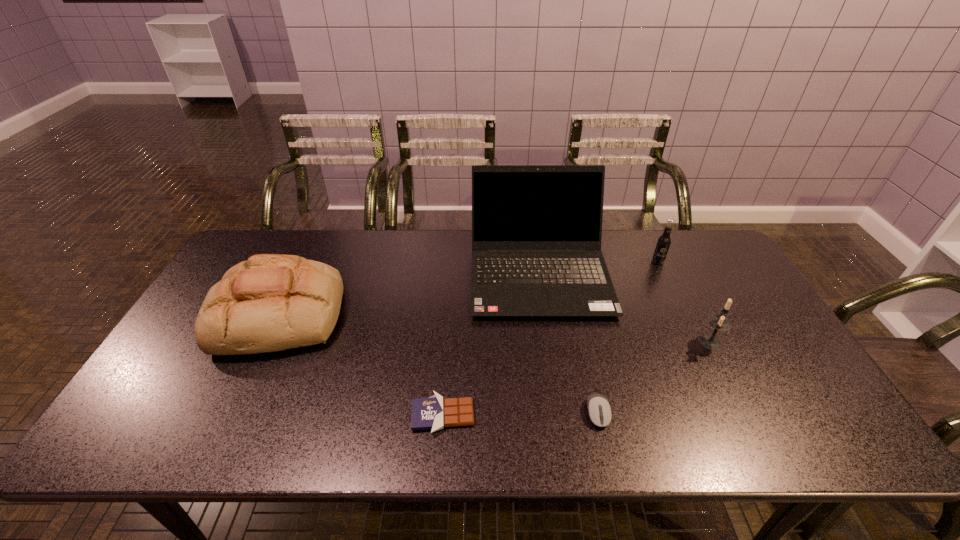
At what (x,y) coordinates should I click in order to perform the action: click on object that is the fourth closest to the root beer. Please return your answer as a coordinate pair (x, y). Looking at the image, I should click on (435, 413).

Identify the location of free region that satisfies the following two spatial constraints: 1. on the label of the candle holder; 2. on the left side of the root beer. (697, 342).